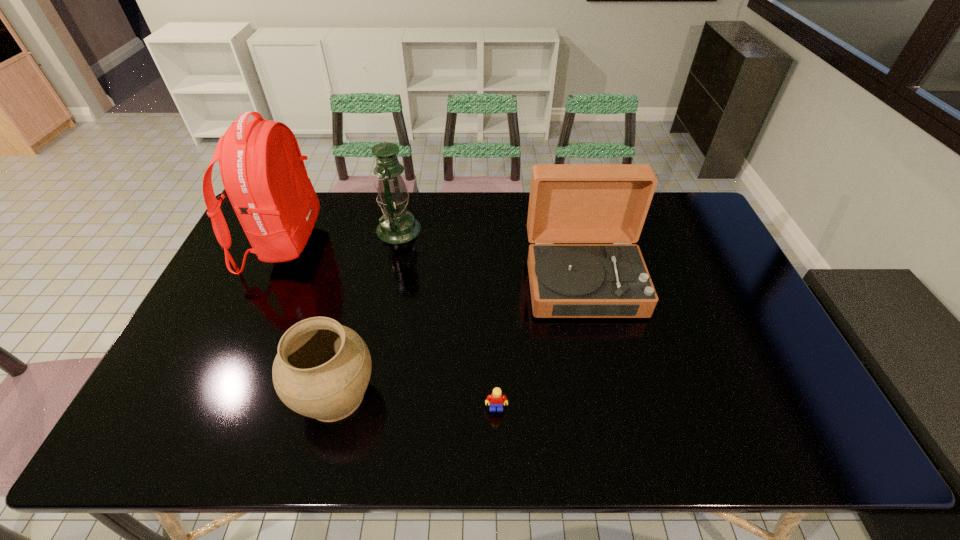
Where is `the tallest object`? This screenshot has height=540, width=960. the tallest object is located at coordinates (264, 176).

Where is `the leftmost object`? Image resolution: width=960 pixels, height=540 pixels. the leftmost object is located at coordinates (264, 176).

Find the location of a particular element. oil lamp is located at coordinates (397, 225).

Identify the location of the rightmost object. (569, 203).

Locate an element on the screen. The image size is (960, 540). the second shortest object is located at coordinates (322, 369).

You are a GUI agent. You are given a task and a screenshot of the screen. Output one action in this format:
    pyautogui.click(x=<x>, y=<y>)
    Task: Click on the shortest object
    Image resolution: width=960 pixels, height=540 pixels.
    Given the screenshot: What is the action you would take?
    pyautogui.click(x=494, y=400)

Identify the location of Lego. The width and height of the screenshot is (960, 540). (494, 400).

Where is `free space located 0.390m on the main compartment of the backpack`? The width and height of the screenshot is (960, 540). free space located 0.390m on the main compartment of the backpack is located at coordinates (436, 244).

Where is `vacant space situated 0.080m on the right of the oil lamp`? This screenshot has height=540, width=960. vacant space situated 0.080m on the right of the oil lamp is located at coordinates (444, 230).

Image resolution: width=960 pixels, height=540 pixels. In order to click on free space located 0.250m on the face of the phonograph record in this screenshot , I will do click(x=610, y=402).